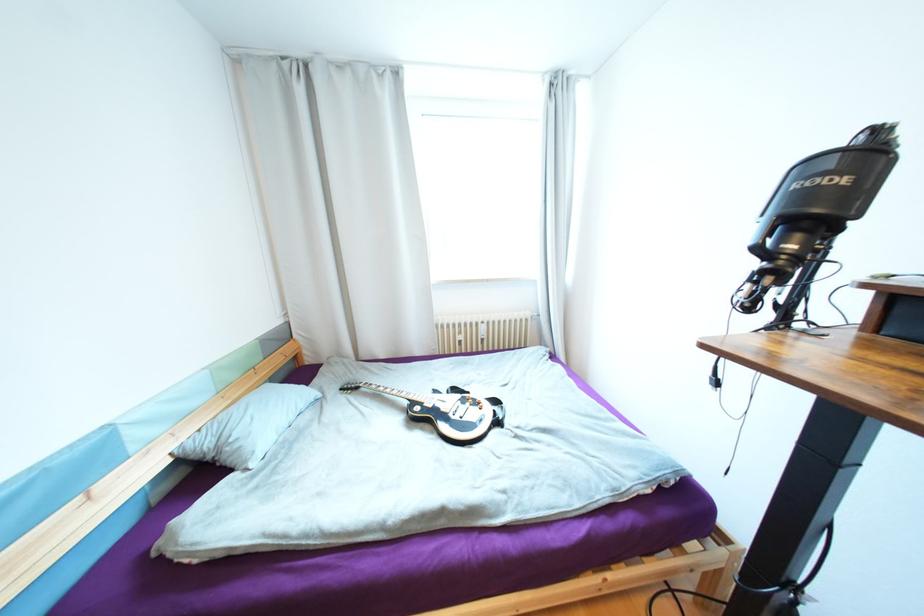
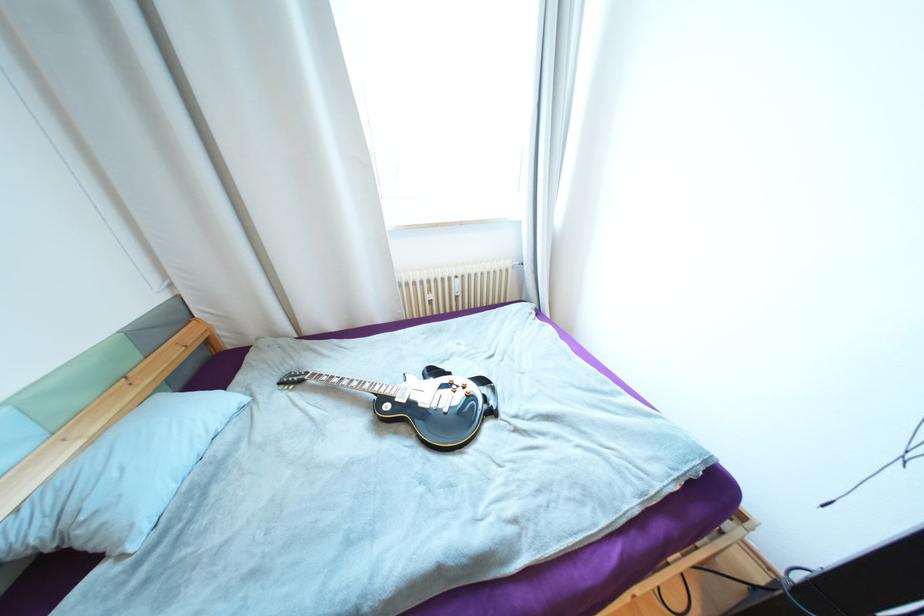
In the second image, find the point that corresponds to point (489, 339) in the first image.

(463, 297)